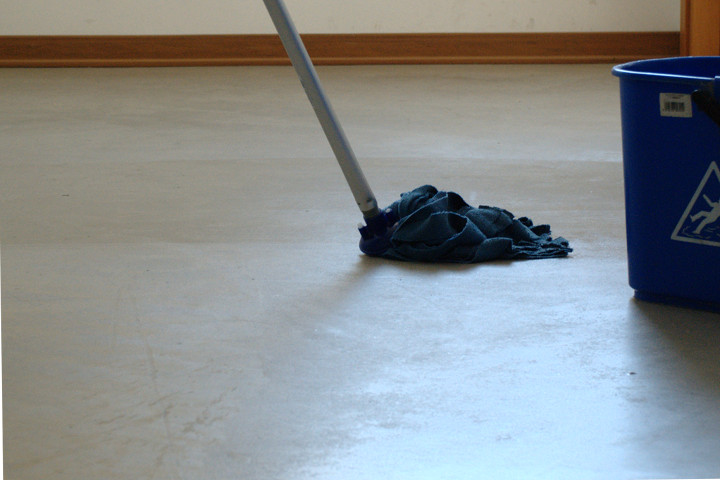
The width and height of the screenshot is (720, 480). I want to click on door frame, so click(693, 32).